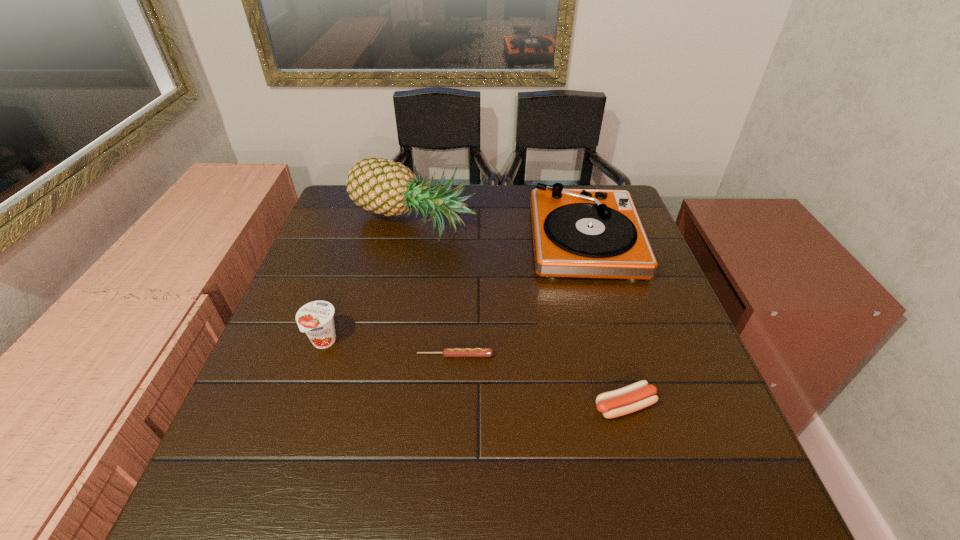
I want to click on pineapple, so click(x=382, y=186).

Locate an element on the screen. This screenshot has height=540, width=960. record player is located at coordinates (585, 233).

Image resolution: width=960 pixels, height=540 pixels. What are the coordinates of `yogurt` in the screenshot? It's located at (316, 319).

The height and width of the screenshot is (540, 960). What are the coordinates of `the taller sausage` in the screenshot? It's located at (636, 396).

Locate an element on the screen. the second shortest object is located at coordinates (636, 396).

Where is `the left sausage`? The width and height of the screenshot is (960, 540). the left sausage is located at coordinates (447, 352).

At what (x,y) coordinates should I click in order to perform the action: click on the farther sausage. Please return your answer as a coordinate pair (x, y). Looking at the image, I should click on (447, 352).

Find the location of `free spot located 0.110m on the right of the pineapple`. free spot located 0.110m on the right of the pineapple is located at coordinates (514, 224).

Where is `vacant space located 0.310m on the front of the record player`? The width and height of the screenshot is (960, 540). vacant space located 0.310m on the front of the record player is located at coordinates (628, 389).

This screenshot has height=540, width=960. I want to click on vacant point located on the right of the third shortest object, so click(387, 342).